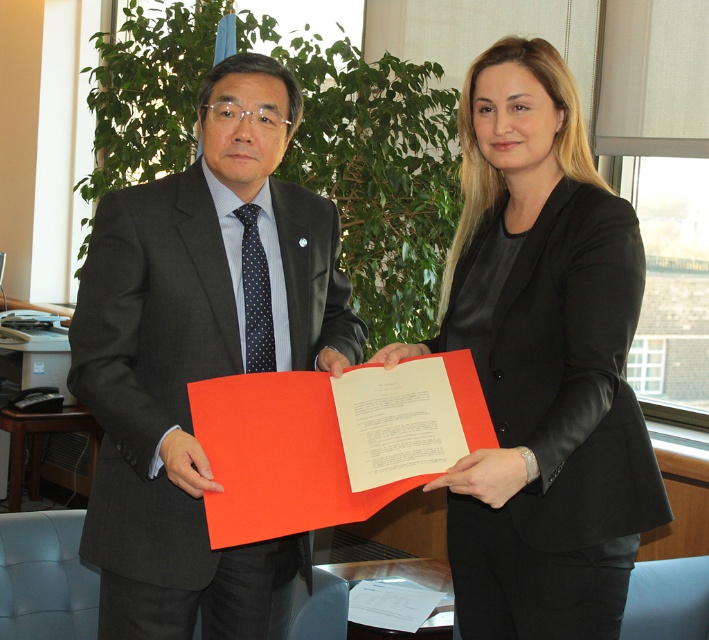
You are a tailor measuring the distance between two items in an office scene. The items are the black leather jacket at center and the matte black suit at center. The tailor needs to know if there is enough space between them to place a 16 inch long tailor board. Can you confirm?

The black leather jacket at center and the matte black suit at center are 18.98 inches apart, which is more than enough space to place a 16 inch long tailor board between them.

You are a security guard in an office building. You see two people standing at the center holding a document. One is wearing a black leather jacket at center and the other is wearing a matte black suit at center. Which one is on the right side when facing the document?

The black leather jacket at center is positioned on the right side of matte black suit at center, so the person wearing the black leather jacket at center is on the right side when facing the document.

You are a tailor measuring two items displayed in the office scene. The items are the black leather jacket at center and the matte black suit at center. Which item has a narrower width according to the description?

The black leather jacket at center has a narrower width than the matte black suit at center.